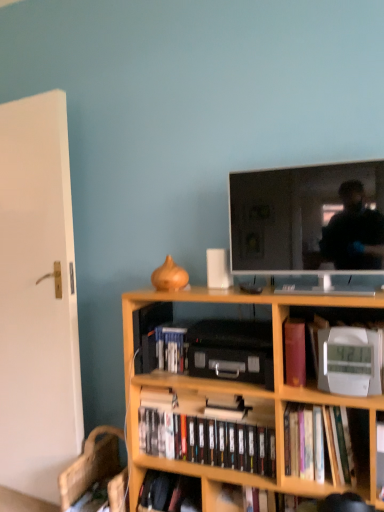
Question: From the image's perspective, is wooden bookcase at center above black matte dvds at center, the fourth book in the top-to-bottom sequence?

Choices:
 (A) no
 (B) yes

Answer: (B)

Question: Is wooden bookcase at center further to the viewer compared to black matte dvds at center, marked as the 2th book in a bottom-to-top arrangement?

Choices:
 (A) yes
 (B) no

Answer: (B)

Question: Is wooden bookcase at center thinner than black matte dvds at center, the fourth book in the top-to-bottom sequence?

Choices:
 (A) no
 (B) yes

Answer: (A)

Question: Considering the relative sizes of wooden bookcase at center and black matte dvds at center, the fourth book in the top-to-bottom sequence, in the image provided, is wooden bookcase at center taller than black matte dvds at center, the fourth book in the top-to-bottom sequence,?

Choices:
 (A) no
 (B) yes

Answer: (B)

Question: From the image's perspective, is wooden bookcase at center beneath black matte dvds at center, the fourth book in the top-to-bottom sequence?

Choices:
 (A) yes
 (B) no

Answer: (B)

Question: Considering the relative sizes of wooden bookcase at center and black matte dvds at center, the fourth book in the top-to-bottom sequence, in the image provided, is wooden bookcase at center smaller than black matte dvds at center, the fourth book in the top-to-bottom sequence,?

Choices:
 (A) no
 (B) yes

Answer: (A)

Question: Is purple matte bookshelf at center, positioned as the second book in top-to-bottom order, shorter than hardcover book at center?

Choices:
 (A) no
 (B) yes

Answer: (B)

Question: Considering the relative sizes of purple matte bookshelf at center, positioned as the second book in top-to-bottom order, and hardcover book at center in the image provided, is purple matte bookshelf at center, positioned as the second book in top-to-bottom order, thinner than hardcover book at center?

Choices:
 (A) no
 (B) yes

Answer: (B)

Question: Is purple matte bookshelf at center, the fourth book positioned from the bottom, far away from hardcover book at center?

Choices:
 (A) no
 (B) yes

Answer: (A)

Question: Can you confirm if purple matte bookshelf at center, positioned as the second book in top-to-bottom order, is smaller than hardcover book at center?

Choices:
 (A) no
 (B) yes

Answer: (B)

Question: From a real-world perspective, is purple matte bookshelf at center, the fourth book positioned from the bottom, located higher than hardcover book at center?

Choices:
 (A) no
 (B) yes

Answer: (B)

Question: Is purple matte bookshelf at center, positioned as the second book in top-to-bottom order, facing towards hardcover book at center?

Choices:
 (A) no
 (B) yes

Answer: (A)

Question: Does purple matte bookshelf at center, the fourth book positioned from the bottom, appear on the left side of flat screen tv at upper center?

Choices:
 (A) yes
 (B) no

Answer: (A)